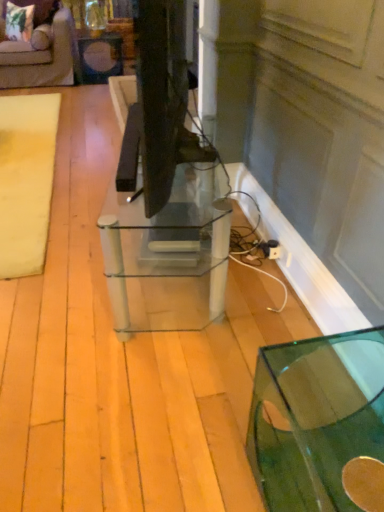
The width and height of the screenshot is (384, 512). I want to click on vacant area that is in front of clear glass table at center, which is counted as the second table, starting from the bottom, so click(x=136, y=380).